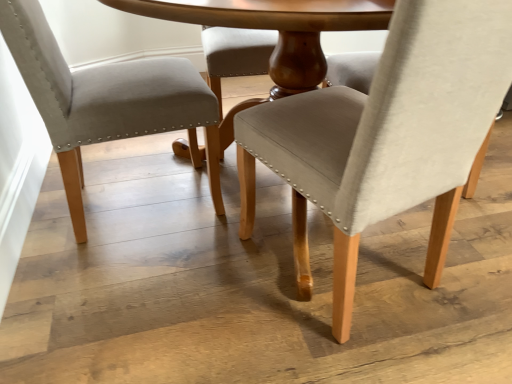
Find the location of `vacant space situated on the left part of matte beige fabric chair at center, which is counted as the 2th chair, starting from the left`. vacant space situated on the left part of matte beige fabric chair at center, which is counted as the 2th chair, starting from the left is located at coordinates (192, 287).